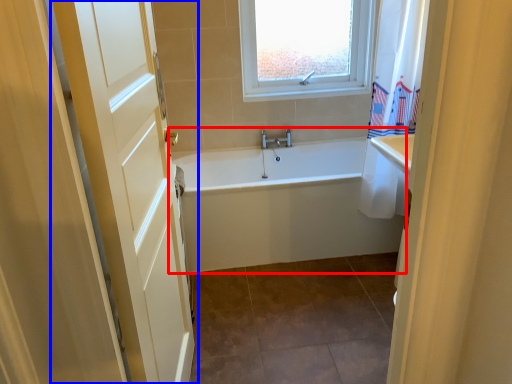
Question: Which object appears farthest to the camera in this image, bathtub (highlighted by a red box) or door (highlighted by a blue box)?

Choices:
 (A) bathtub
 (B) door

Answer: (A)